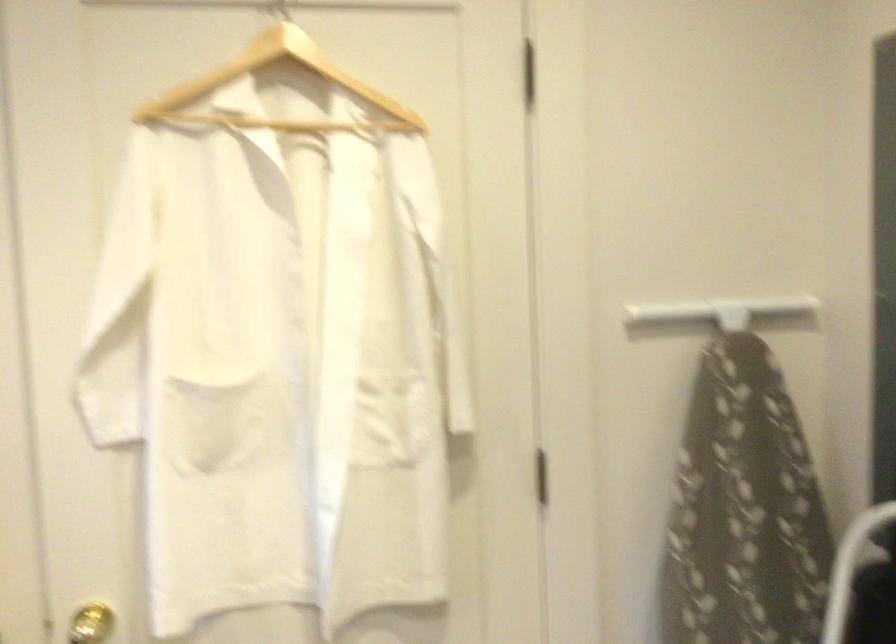
Image resolution: width=896 pixels, height=644 pixels. Describe the element at coordinates (90, 623) in the screenshot. I see `the gold doorknob` at that location.